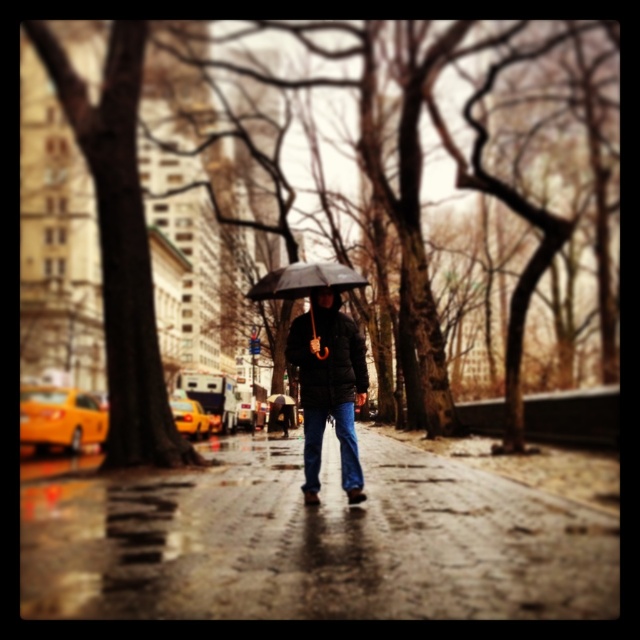
Question: Is wet asphalt sidewalk at center smaller than matte black jacket at center?

Choices:
 (A) no
 (B) yes

Answer: (A)

Question: Which of these objects is positioned closest to the black matte umbrella at center?

Choices:
 (A) wet asphalt sidewalk at center
 (B) matte black jacket at center

Answer: (B)

Question: Does wet asphalt sidewalk at center have a lesser width compared to black matte umbrella at center?

Choices:
 (A) no
 (B) yes

Answer: (A)

Question: Which object appears closest to the camera in this image?

Choices:
 (A) matte black jacket at center
 (B) wet asphalt sidewalk at center
 (C) black matte umbrella at center

Answer: (B)

Question: Does wet asphalt sidewalk at center have a larger size compared to black matte umbrella at center?

Choices:
 (A) yes
 (B) no

Answer: (A)

Question: Which point is closer to the camera taking this photo?

Choices:
 (A) (45, 570)
 (B) (353, 465)
 (C) (288, 285)

Answer: (A)